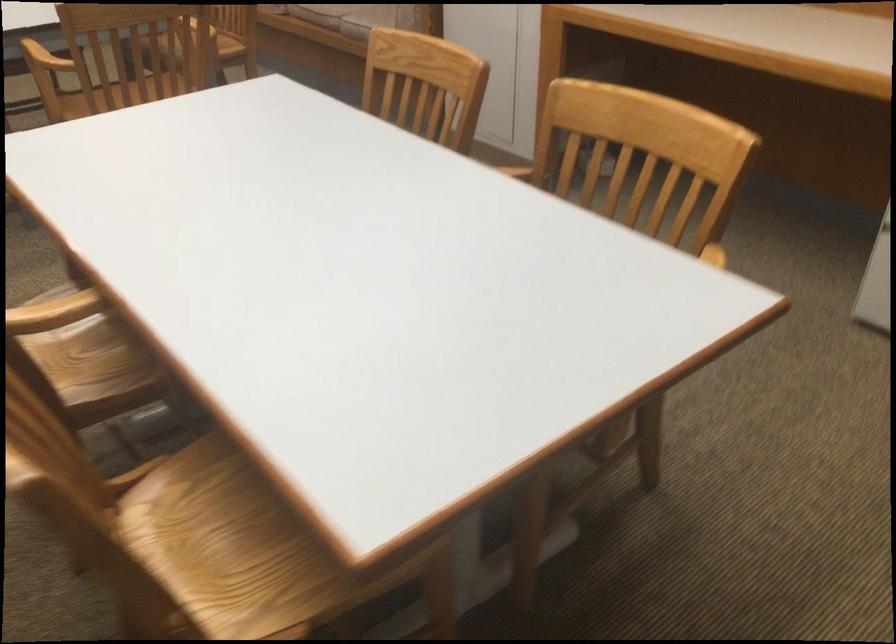
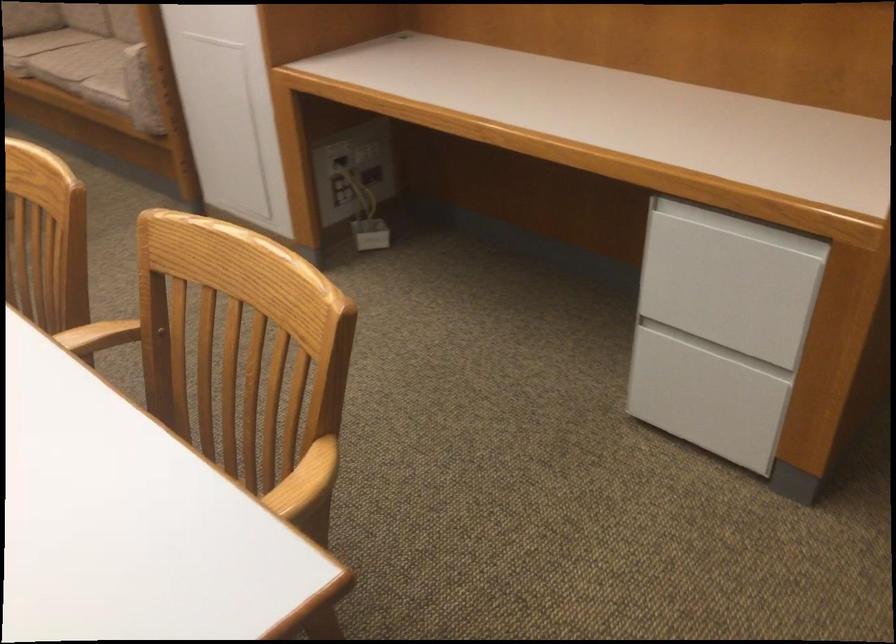
Question: The first image is from the beginning of the video and the second image is from the end. How did the camera likely rotate when shooting the video?

Choices:
 (A) Left
 (B) Right
 (C) Up
 (D) Down

Answer: (B)